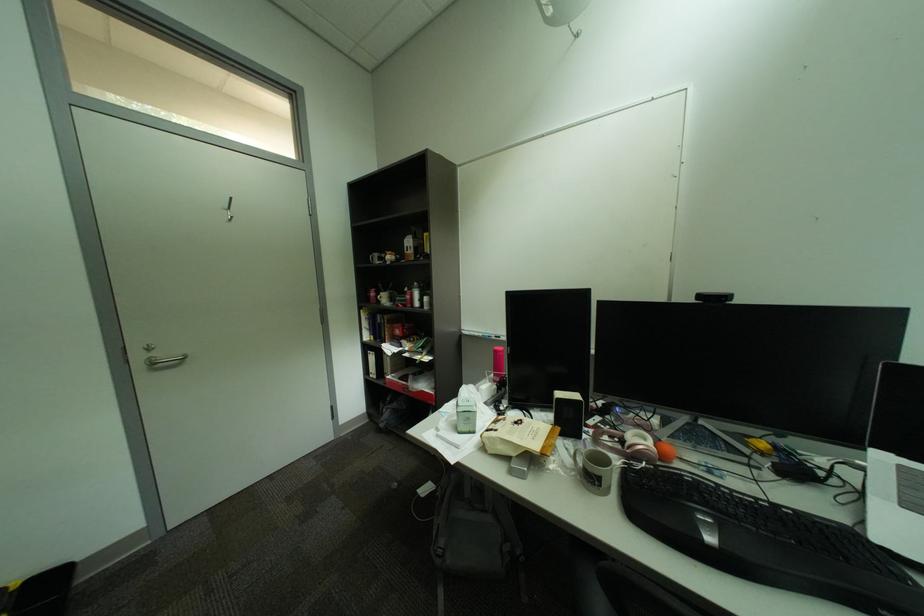
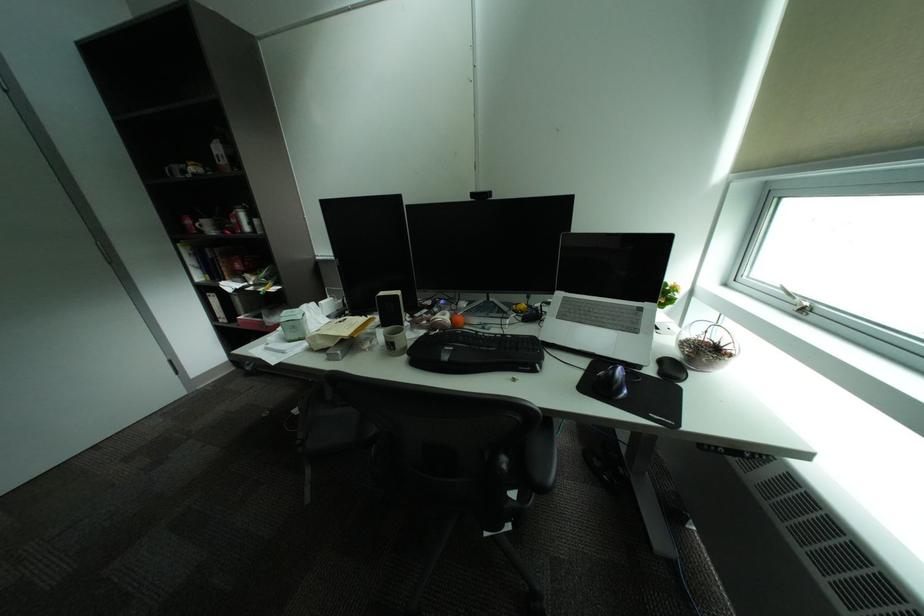
Locate, in the second image, the point that corresponds to pixel 657 440 in the first image.

(456, 315)